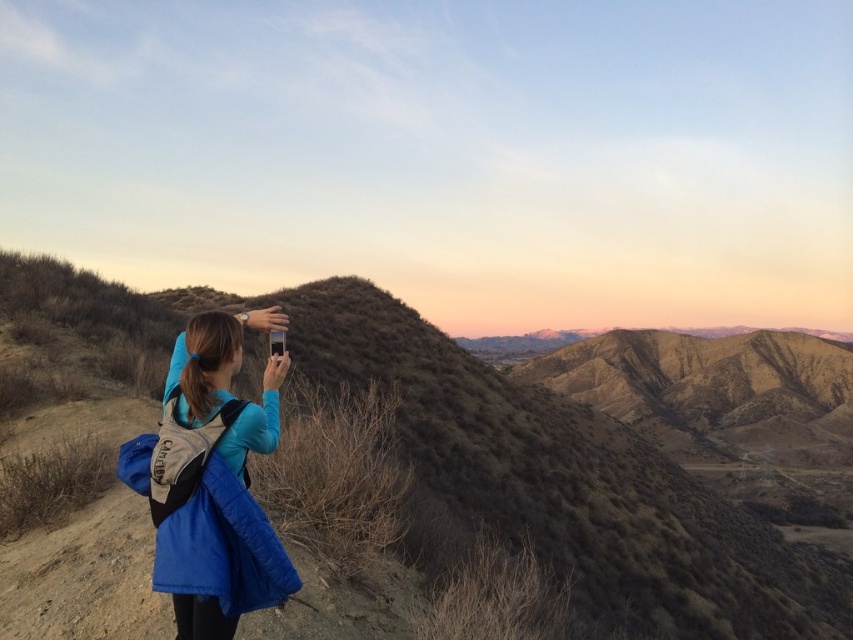
You are a hiker who wants to take a photo of the brown textured hillside at center while standing where the blue synthetic jacket at center is located. Can you fit the entire hillside into your smartphone camera frame without moving your position?

The brown textured hillside at center and blue synthetic jacket at center are 26.53 meters apart from each other. Since the distance between them is significant, it is likely that the entire hillside can be captured in the smartphone camera frame without needing to move.

You are standing at the point with coordinates point (x=209, y=604) and want to reach the point with coordinates point (x=459, y=385). Which direction should you move in to get closer?

You should move backward because point (x=459, y=385) is behind point (x=209, y=604).

You are a hiker who wants to take a photo of the brown textured hillside at center while wearing the blue synthetic jacket at center. Can you fit both the entire hillside and your jacket in the frame at the same time?

The brown textured hillside at center is bigger than the blue synthetic jacket at center, so yes, you can fit both the entire hillside and your jacket in the frame at the same time because the hillside is larger and can accommodate the jacket in the photo.